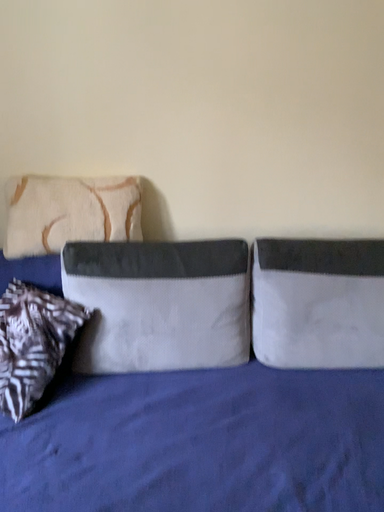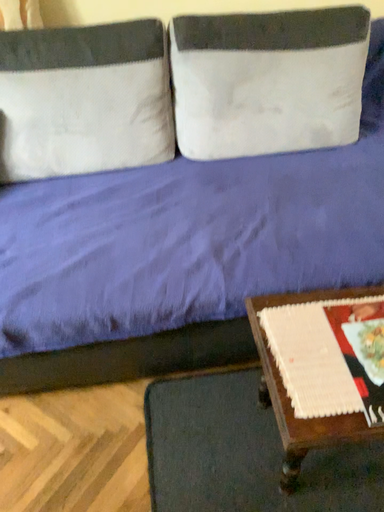
Question: Which way did the camera rotate in the video?

Choices:
 (A) rotated left
 (B) rotated right

Answer: (B)